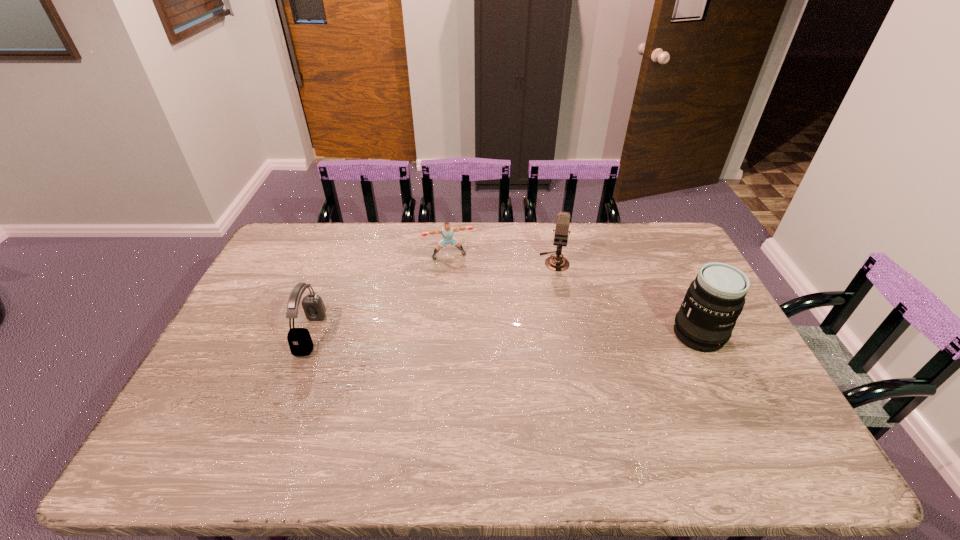
Where is `blank space located on the front-facing side of the microphone`? blank space located on the front-facing side of the microphone is located at coordinates (546, 363).

Identify the location of blank space located on the front-facing side of the microphone. (551, 308).

The height and width of the screenshot is (540, 960). I want to click on vacant area situated 0.120m on the front-facing side of the microphone, so [x=552, y=295].

Locate an element on the screen. vacant area located on the front-facing side of the puncher is located at coordinates (462, 285).

Locate an element on the screen. vacant area located 0.370m on the front-facing side of the puncher is located at coordinates (478, 338).

This screenshot has width=960, height=540. What are the coordinates of `vacant point located on the front-facing side of the puncher` in the screenshot? It's located at (477, 335).

You are a GUI agent. You are given a task and a screenshot of the screen. Output one action in this format:
    pyautogui.click(x=<x>, y=<y>)
    Task: Click on the microphone located at the far edge
    This screenshot has width=960, height=540.
    Given the screenshot: What is the action you would take?
    pyautogui.click(x=556, y=263)

In order to click on puncher present at the far edge in this screenshot , I will do click(447, 231).

Where is `object positioned at the right edge`? This screenshot has width=960, height=540. object positioned at the right edge is located at coordinates (713, 302).

The width and height of the screenshot is (960, 540). Find the location of `vacant region at the far edge of the desktop`. vacant region at the far edge of the desktop is located at coordinates (587, 235).